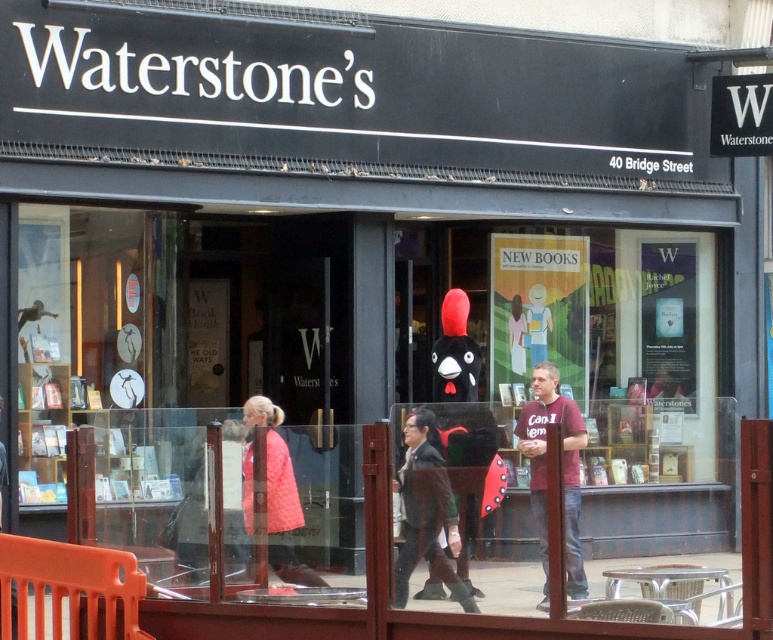
From the picture: Does dark brown leather jacket at center have a lesser height compared to matte red t-shirt at center?

Indeed, dark brown leather jacket at center has a lesser height compared to matte red t-shirt at center.

Can you confirm if dark brown leather jacket at center is positioned to the right of matte red t-shirt at center?

In fact, dark brown leather jacket at center is to the left of matte red t-shirt at center.

Locate an element on the screen. dark brown leather jacket at center is located at coordinates (426, 512).

Does dark brown leather jacket at center have a smaller size compared to quilted pink coat at center?

Actually, dark brown leather jacket at center might be larger than quilted pink coat at center.

Which is in front, point (404, 592) or point (271, 432)?

Positioned in front is point (404, 592).

You are a GUI agent. You are given a task and a screenshot of the screen. Output one action in this format:
    pyautogui.click(x=<x>, y=<y>)
    Task: Click on the dark brown leather jacket at center
    Image resolution: width=773 pixels, height=640 pixels.
    Given the screenshot: What is the action you would take?
    pyautogui.click(x=426, y=512)

In order to click on dark brown leather jacket at center in this screenshot , I will do `click(426, 512)`.

Can you confirm if matte red t-shirt at center is positioned above quilted pink coat at center?

Yes.

Is matte red t-shirt at center to the left of quilted pink coat at center from the viewer's perspective?

Incorrect, matte red t-shirt at center is not on the left side of quilted pink coat at center.

Locate an element on the screen. The image size is (773, 640). matte red t-shirt at center is located at coordinates (545, 470).